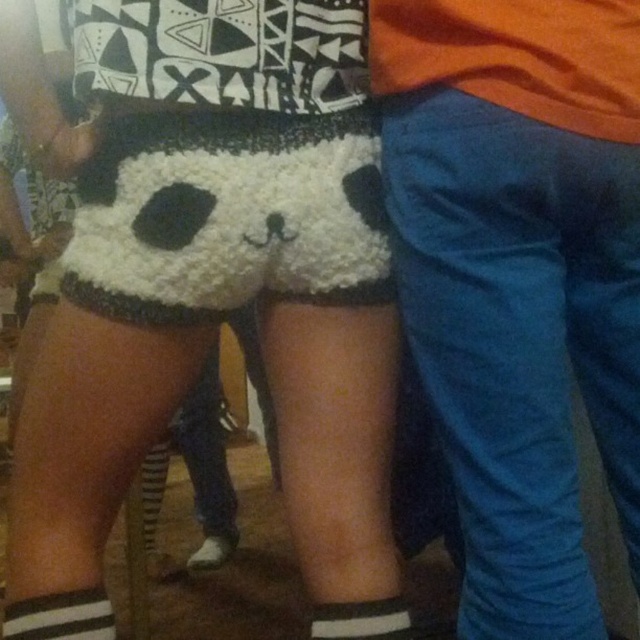
Can you confirm if white fluffy shorts at center is positioned to the right of white striped sock at lower left?

Indeed, white fluffy shorts at center is positioned on the right side of white striped sock at lower left.

Between point (513, 294) and point (97, 588), which one is positioned behind?

Point (97, 588)

In order to click on white fluffy shorts at center in this screenshot , I will do `click(518, 340)`.

Where is `white fluffy shorts at center`? white fluffy shorts at center is located at coordinates (518, 340).

Which is in front, point (97, 180) or point (108, 602)?

Point (97, 180) is more forward.

Can you confirm if white fuzzy shorts at center is positioned above white striped sock at lower left?

Yes.

You are a GUI agent. You are given a task and a screenshot of the screen. Output one action in this format:
    pyautogui.click(x=<x>, y=<y>)
    Task: Click on the white fuzzy shorts at center
    
    Given the screenshot: What is the action you would take?
    pyautogui.click(x=227, y=216)

Who is taller, white fluffy shorts at center or white knit sock at lower center?

Standing taller between the two is white fluffy shorts at center.

Can you confirm if white fluffy shorts at center is shorter than white knit sock at lower center?

No.

Which is behind, point (538, 547) or point (394, 621)?

Positioned behind is point (394, 621).

I want to click on white fluffy shorts at center, so click(x=518, y=340).